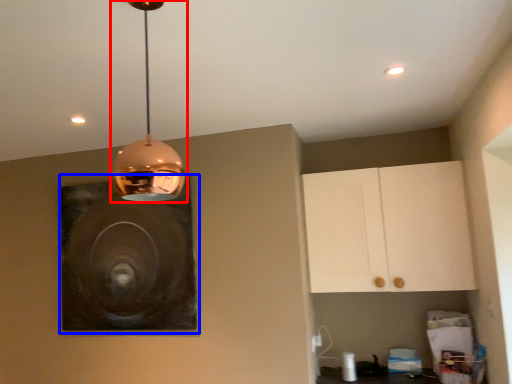
Question: Which point is further to the camera, lamp (highlighted by a red box) or picture frame (highlighted by a blue box)?

Choices:
 (A) lamp
 (B) picture frame

Answer: (B)